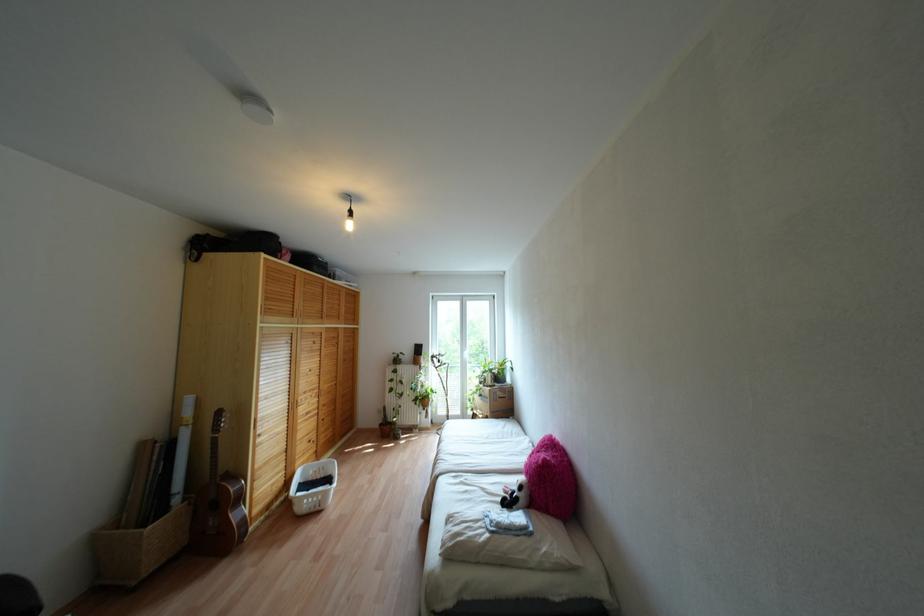
The height and width of the screenshot is (616, 924). What do you see at coordinates (348, 216) in the screenshot?
I see `the light bulb` at bounding box center [348, 216].